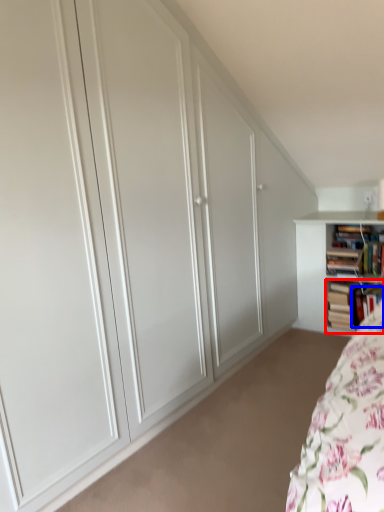
Question: Among these objects, which one is nearest to the camera, book (highlighted by a red box) or book (highlighted by a blue box)?

Choices:
 (A) book
 (B) book

Answer: (B)